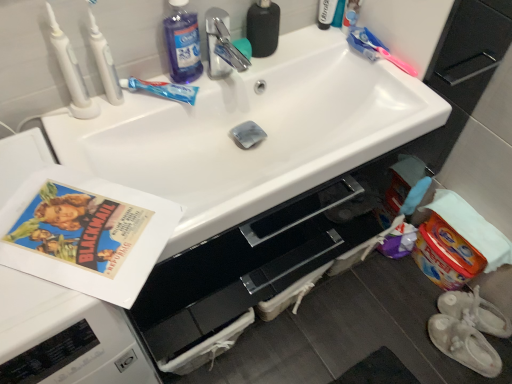
Question: Should I look upward or downward to see white plastic toothbrush at upper left, the second toothbrush viewed from the left?

Choices:
 (A) up
 (B) down

Answer: (A)

Question: Does white plastic toothbrush at upper left, placed as the 3th toothbrush when sorted from right to left, lie in front of vintage paper at left?

Choices:
 (A) yes
 (B) no

Answer: (B)

Question: From a real-world perspective, is white plastic toothbrush at upper left, the second toothbrush viewed from the left, beneath vintage paper at left?

Choices:
 (A) yes
 (B) no

Answer: (B)

Question: Is white plastic toothbrush at upper left, placed as the 3th toothbrush when sorted from right to left, located outside vintage paper at left?

Choices:
 (A) yes
 (B) no

Answer: (A)

Question: Is white plastic toothbrush at upper left, the second toothbrush viewed from the left, to the right of vintage paper at left from the viewer's perspective?

Choices:
 (A) no
 (B) yes

Answer: (A)

Question: Is white plastic toothbrush at upper left, placed as the 3th toothbrush when sorted from right to left, far away from vintage paper at left?

Choices:
 (A) yes
 (B) no

Answer: (B)

Question: Does white plastic toothbrush at upper left, the second toothbrush viewed from the left, have a greater width compared to vintage paper at left?

Choices:
 (A) no
 (B) yes

Answer: (A)

Question: Is pink plastic toothbrush at upper right, which is the fourth toothbrush from left to right, not inside white plastic toothbrush at upper left, arranged as the fourth toothbrush when viewed from the right?

Choices:
 (A) yes
 (B) no

Answer: (A)

Question: Does pink plastic toothbrush at upper right, which is the fourth toothbrush from left to right, have a lesser width compared to white plastic toothbrush at upper left, arranged as the fourth toothbrush when viewed from the right?

Choices:
 (A) no
 (B) yes

Answer: (B)

Question: Does pink plastic toothbrush at upper right, the 1th toothbrush viewed from the right, have a lesser height compared to white plastic toothbrush at upper left, arranged as the fourth toothbrush when viewed from the right?

Choices:
 (A) yes
 (B) no

Answer: (A)

Question: Can you confirm if pink plastic toothbrush at upper right, which is the fourth toothbrush from left to right, is taller than white plastic toothbrush at upper left, arranged as the fourth toothbrush when viewed from the right?

Choices:
 (A) no
 (B) yes

Answer: (A)

Question: From a real-world perspective, is pink plastic toothbrush at upper right, the 1th toothbrush viewed from the right, located higher than white plastic toothbrush at upper left, which ranks as the first toothbrush in left-to-right order?

Choices:
 (A) no
 (B) yes

Answer: (A)

Question: Is the depth of pink plastic toothbrush at upper right, the 1th toothbrush viewed from the right, less than that of white plastic toothbrush at upper left, arranged as the fourth toothbrush when viewed from the right?

Choices:
 (A) yes
 (B) no

Answer: (B)

Question: Does translucent blue toothpaste at upper center, placed as the second toothbrush when sorted from right to left, come behind white glossy sink at center?

Choices:
 (A) yes
 (B) no

Answer: (A)